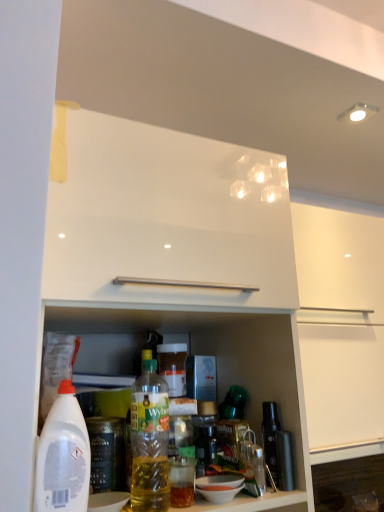
Question: Is white plastic bottle at lower left, the second bottle positioned from the right, to the right of translucent plastic bottle at center, placed as the second bottle when sorted from left to right, from the viewer's perspective?

Choices:
 (A) no
 (B) yes

Answer: (A)

Question: Does white plastic bottle at lower left, the second bottle positioned from the right, have a smaller size compared to translucent plastic bottle at center, positioned as the first bottle in right-to-left order?

Choices:
 (A) no
 (B) yes

Answer: (B)

Question: Is white plastic bottle at lower left, which ranks as the first bottle in left-to-right order, thinner than translucent plastic bottle at center, positioned as the first bottle in right-to-left order?

Choices:
 (A) no
 (B) yes

Answer: (B)

Question: Can you confirm if white plastic bottle at lower left, which ranks as the first bottle in left-to-right order, is taller than translucent plastic bottle at center, placed as the second bottle when sorted from left to right?

Choices:
 (A) yes
 (B) no

Answer: (B)

Question: Is the depth of white plastic bottle at lower left, the second bottle positioned from the right, less than that of translucent plastic bottle at center, positioned as the first bottle in right-to-left order?

Choices:
 (A) no
 (B) yes

Answer: (B)

Question: From the image's perspective, is white plastic bottle at lower left, which ranks as the first bottle in left-to-right order, below translucent plastic bottle at center, placed as the second bottle when sorted from left to right?

Choices:
 (A) no
 (B) yes

Answer: (A)

Question: Can you confirm if translucent plastic bottle at center, positioned as the first bottle in right-to-left order, is smaller than white plastic bottle at lower left, the second bottle positioned from the right?

Choices:
 (A) yes
 (B) no

Answer: (B)

Question: Considering the relative positions of translucent plastic bottle at center, placed as the second bottle when sorted from left to right, and white plastic bottle at lower left, which ranks as the first bottle in left-to-right order, in the image provided, is translucent plastic bottle at center, placed as the second bottle when sorted from left to right, behind white plastic bottle at lower left, which ranks as the first bottle in left-to-right order,?

Choices:
 (A) no
 (B) yes

Answer: (B)

Question: Is translucent plastic bottle at center, placed as the second bottle when sorted from left to right, positioned before white plastic bottle at lower left, the second bottle positioned from the right?

Choices:
 (A) yes
 (B) no

Answer: (B)

Question: Is translucent plastic bottle at center, positioned as the first bottle in right-to-left order, taller than white plastic bottle at lower left, which ranks as the first bottle in left-to-right order?

Choices:
 (A) yes
 (B) no

Answer: (A)

Question: Considering the relative sizes of translucent plastic bottle at center, placed as the second bottle when sorted from left to right, and white plastic bottle at lower left, which ranks as the first bottle in left-to-right order, in the image provided, is translucent plastic bottle at center, placed as the second bottle when sorted from left to right, thinner than white plastic bottle at lower left, which ranks as the first bottle in left-to-right order,?

Choices:
 (A) yes
 (B) no

Answer: (B)

Question: Can you confirm if translucent plastic bottle at center, positioned as the first bottle in right-to-left order, is positioned to the left of white plastic bottle at lower left, the second bottle positioned from the right?

Choices:
 (A) no
 (B) yes

Answer: (A)

Question: Based on their sizes in the image, would you say white plastic bottle at lower left, the second bottle positioned from the right, is bigger or smaller than translucent plastic bottle at center, placed as the second bottle when sorted from left to right?

Choices:
 (A) small
 (B) big

Answer: (A)